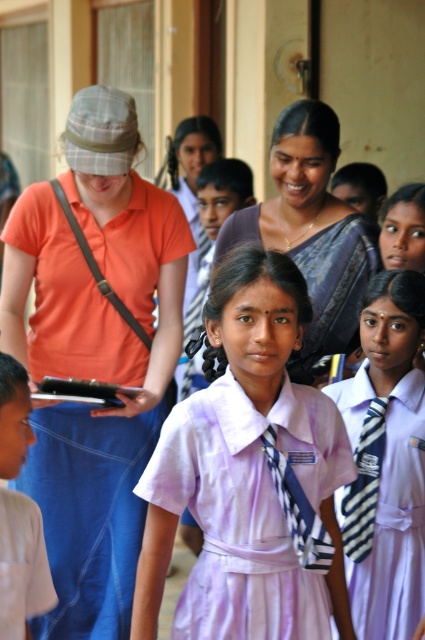
Where is `orange cotton shirt at center`? orange cotton shirt at center is located at coordinates (95, 355).

Image resolution: width=425 pixels, height=640 pixels. What do you see at coordinates (95, 355) in the screenshot? I see `orange cotton shirt at center` at bounding box center [95, 355].

Between point (87, 324) and point (314, 326), which one is positioned in front?

Positioned in front is point (314, 326).

You are a GUI agent. You are given a task and a screenshot of the screen. Output one action in this format:
    pyautogui.click(x=<x>, y=<y>)
    Task: Click on the orange cotton shirt at center
    Image resolution: width=425 pixels, height=640 pixels.
    Given the screenshot: What is the action you would take?
    [95, 355]

Who is higher up, purple silk saree at center or white uniform at center?

purple silk saree at center is above.

Find the location of a particular element. purple silk saree at center is located at coordinates (311, 230).

Between point (345, 307) and point (30, 570), which one is positioned behind?

Point (345, 307)

This screenshot has height=640, width=425. What are the coordinates of `purple silk saree at center` in the screenshot? It's located at (311, 230).

Measure the distance between orange cotton shirt at center and blue striped tie at center.

The distance of orange cotton shirt at center from blue striped tie at center is 1.49 meters.

Between orange cotton shirt at center and blue striped tie at center, which one appears on the right side from the viewer's perspective?

Positioned to the right is blue striped tie at center.

Which is behind, point (27, 490) or point (282, 506)?

The point (27, 490) is more distant.

Image resolution: width=425 pixels, height=640 pixels. Find the location of `orange cotton shirt at center`. orange cotton shirt at center is located at coordinates [x=95, y=355].